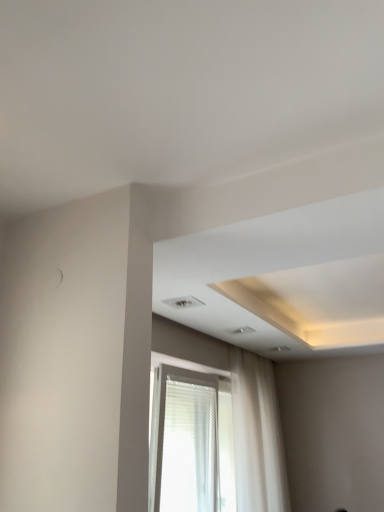
Question: Is white sheer curtain at lower center in front of white sheer curtain at center?

Choices:
 (A) no
 (B) yes

Answer: (B)

Question: From a real-world perspective, is white sheer curtain at lower center beneath white sheer curtain at center?

Choices:
 (A) no
 (B) yes

Answer: (B)

Question: Does white sheer curtain at lower center have a greater height compared to white sheer curtain at center?

Choices:
 (A) yes
 (B) no

Answer: (B)

Question: From a real-world perspective, is white sheer curtain at lower center positioned over white sheer curtain at center based on gravity?

Choices:
 (A) no
 (B) yes

Answer: (A)

Question: Considering the relative sizes of white sheer curtain at lower center and white sheer curtain at center in the image provided, is white sheer curtain at lower center shorter than white sheer curtain at center?

Choices:
 (A) no
 (B) yes

Answer: (B)

Question: Is white sheer curtain at lower center far away from white sheer curtain at center?

Choices:
 (A) no
 (B) yes

Answer: (A)

Question: From the image's perspective, is white sheer curtain at center on top of white sheer curtain at lower center?

Choices:
 (A) yes
 (B) no

Answer: (B)

Question: Can you confirm if white sheer curtain at center is taller than white sheer curtain at lower center?

Choices:
 (A) no
 (B) yes

Answer: (B)

Question: Considering the relative sizes of white sheer curtain at center and white sheer curtain at lower center in the image provided, is white sheer curtain at center thinner than white sheer curtain at lower center?

Choices:
 (A) no
 (B) yes

Answer: (A)

Question: Can you confirm if white sheer curtain at center is wider than white sheer curtain at lower center?

Choices:
 (A) no
 (B) yes

Answer: (B)

Question: Is white sheer curtain at center aimed at white sheer curtain at lower center?

Choices:
 (A) no
 (B) yes

Answer: (A)

Question: Does white sheer curtain at center have a lesser height compared to white sheer curtain at lower center?

Choices:
 (A) no
 (B) yes

Answer: (A)

Question: From a real-world perspective, is white sheer curtain at lower center above or below white sheer curtain at center?

Choices:
 (A) above
 (B) below

Answer: (B)